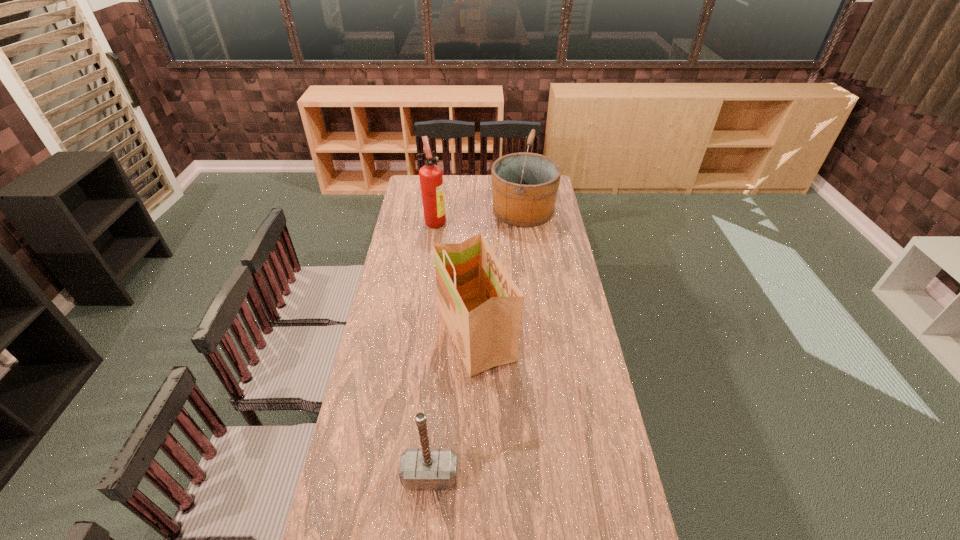
Where is `object located in the left edge section of the desktop`? The width and height of the screenshot is (960, 540). object located in the left edge section of the desktop is located at coordinates (431, 179).

The width and height of the screenshot is (960, 540). Identify the location of object located in the right edge section of the desktop. (524, 185).

Find the location of a particular element. This screenshot has width=960, height=540. object present at the far right corner is located at coordinates (524, 185).

You are a GUI agent. You are given a task and a screenshot of the screen. Output one action in this format:
    pyautogui.click(x=<x>, y=<y>)
    Task: Click on the free space at the left edge of the desktop
    
    Given the screenshot: What is the action you would take?
    pyautogui.click(x=414, y=298)

In the image, there is a desktop. At what (x,y) coordinates should I click in order to perform the action: click on vacant space at the right edge. Please return your answer as a coordinate pair (x, y). Looking at the image, I should click on (553, 255).

This screenshot has width=960, height=540. What are the coordinates of `vacant space at the far left corner` in the screenshot? It's located at (419, 196).

Find the location of a particular element. empty space between the fire extinguisher and the bucket is located at coordinates (479, 215).

Identify the location of vacant point located between the second nearest object and the nearest object. (453, 405).

Where is `vacant space that's between the fire extinguisher and the bucket`? vacant space that's between the fire extinguisher and the bucket is located at coordinates (479, 215).

Locate an element on the screen. This screenshot has height=540, width=960. free space between the fire extinguisher and the shortest object is located at coordinates (433, 349).